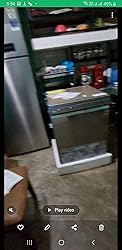
At what (x,y) coordinates should I click in order to perform the action: click on flooring. Please return your answer as a coordinate pair (x, y). Looking at the image, I should click on (83, 186).